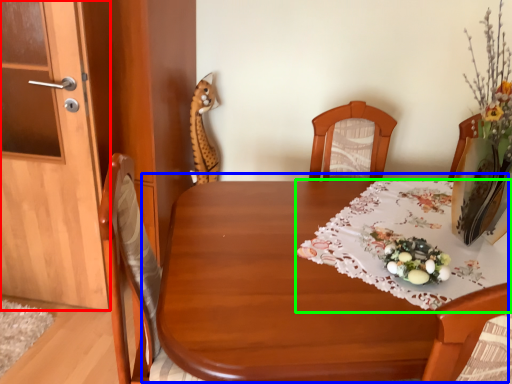
Question: Which object is the farthest from door (highlighted by a red box)? Choose among these: table (highlighted by a blue box) or tablecloth (highlighted by a green box).

Choices:
 (A) table
 (B) tablecloth

Answer: (B)